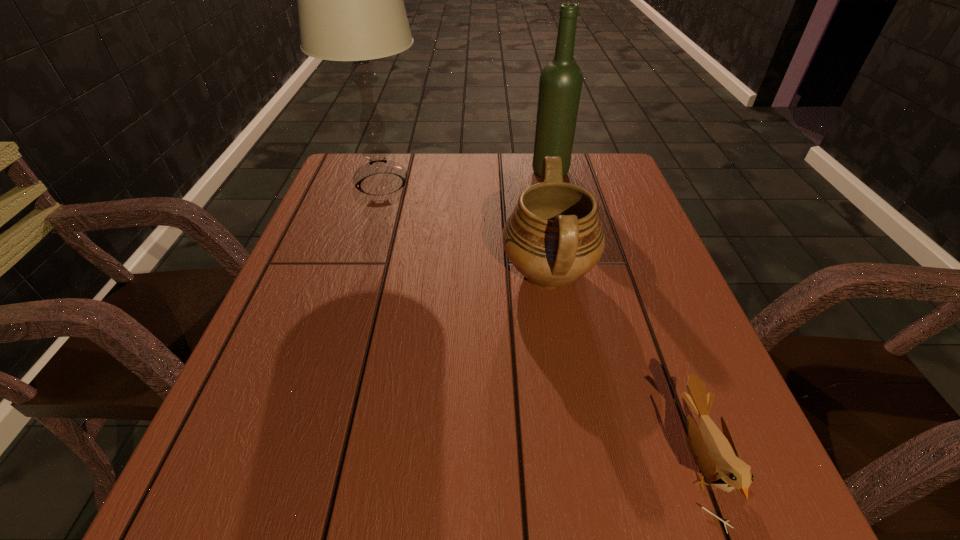
This screenshot has height=540, width=960. I want to click on free area in between the wine bottle and the table lamp, so click(466, 178).

The width and height of the screenshot is (960, 540). I want to click on empty location between the shortest object and the wine bottle, so click(625, 316).

You are a GUI agent. You are given a task and a screenshot of the screen. Output one action in this format:
    pyautogui.click(x=<x>, y=<y>)
    Task: Click on the object that is the closest one to the rightmost object
    
    Given the screenshot: What is the action you would take?
    pyautogui.click(x=553, y=237)

Identify the location of the closest object to the table lamp. (553, 237).